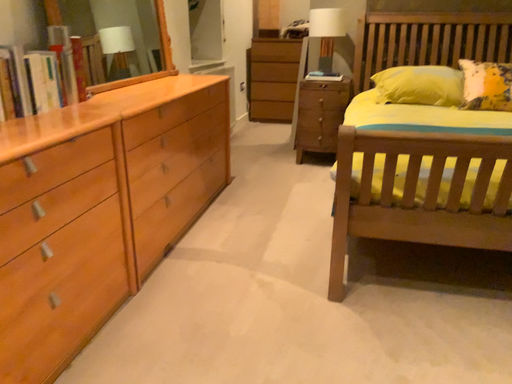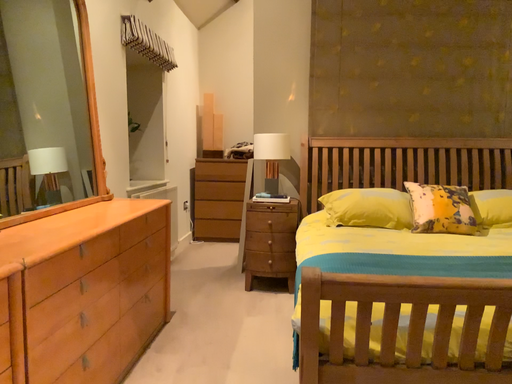
Question: Which way did the camera rotate in the video?

Choices:
 (A) rotated upward
 (B) rotated downward

Answer: (A)